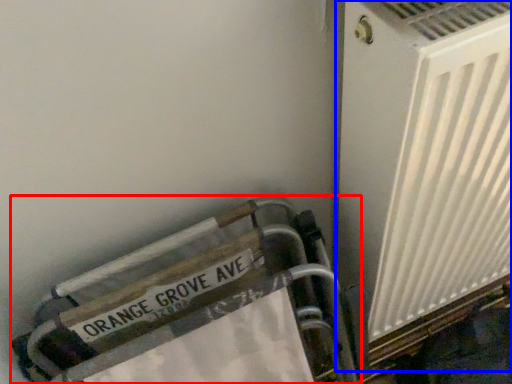
Question: Which object appears closest to the camera in this image, furniture (highlighted by a red box) or air conditioning (highlighted by a blue box)?

Choices:
 (A) furniture
 (B) air conditioning

Answer: (B)